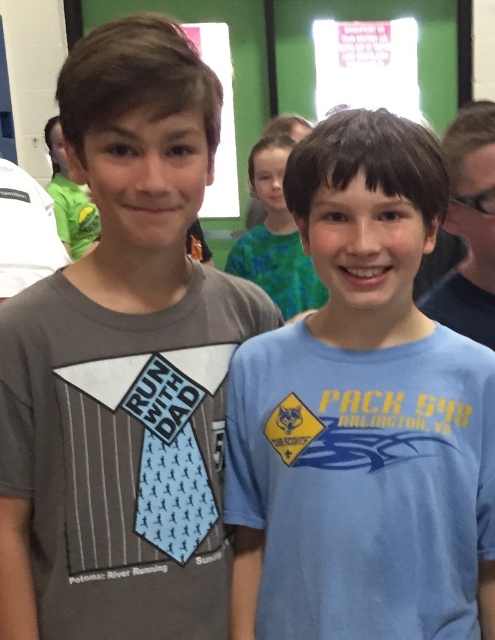
You are a photographer standing 2 meters away from the blue cotton shirt at center and the green matte shirt at center. You want to take a photo that includes both shirts without moving them. Can you fit both shirts into the frame of your camera, which has a maximum width of 2 meters?

The distance between the blue cotton shirt at center and green matte shirt at center is 1.54 meters, which is less than the camera frame width of 2 meters. Therefore, both shirts can fit into the frame without moving them.